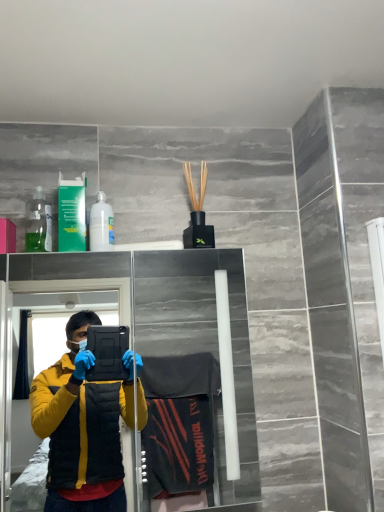
Question: From the image's perspective, is transparent glass door at upper center located above or below transparent plastic bottle at upper left?

Choices:
 (A) above
 (B) below

Answer: (B)

Question: Based on their positions, is transparent glass door at upper center located to the left or right of transparent plastic bottle at upper left?

Choices:
 (A) right
 (B) left

Answer: (A)

Question: Which is farther from the white matte bottle at upper left?

Choices:
 (A) transparent plastic bottle at upper left
 (B) transparent glass door at upper center

Answer: (B)

Question: Which object is the closest to the transparent plastic bottle at upper left?

Choices:
 (A) white matte bottle at upper left
 (B) transparent glass door at upper center

Answer: (A)